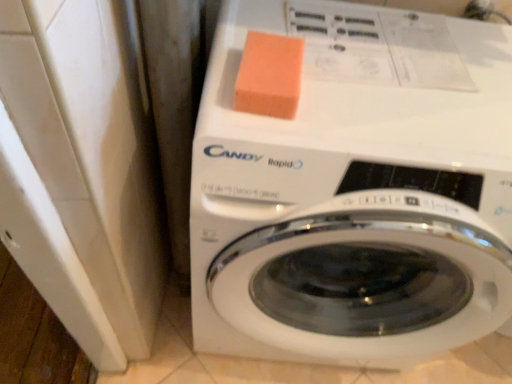
Question: Is orange sponge at upper center with white glossy washing machine at center?

Choices:
 (A) yes
 (B) no

Answer: (B)

Question: Is orange sponge at upper center further to camera compared to white glossy washing machine at center?

Choices:
 (A) yes
 (B) no

Answer: (A)

Question: From the image's perspective, is orange sponge at upper center under white glossy washing machine at center?

Choices:
 (A) yes
 (B) no

Answer: (B)

Question: Would you say orange sponge at upper center is a long distance from white glossy washing machine at center?

Choices:
 (A) yes
 (B) no

Answer: (B)

Question: Is orange sponge at upper center facing towards white glossy washing machine at center?

Choices:
 (A) yes
 (B) no

Answer: (B)

Question: Can white glossy washing machine at center be found inside orange sponge at upper center?

Choices:
 (A) no
 (B) yes

Answer: (A)

Question: Is white glossy washing machine at center next to orange sponge at upper center?

Choices:
 (A) no
 (B) yes

Answer: (A)

Question: From the image's perspective, would you say white glossy washing machine at center is shown under orange sponge at upper center?

Choices:
 (A) no
 (B) yes

Answer: (B)

Question: Can you confirm if white glossy washing machine at center is taller than orange sponge at upper center?

Choices:
 (A) yes
 (B) no

Answer: (A)

Question: Is white glossy washing machine at center positioned with its back to orange sponge at upper center?

Choices:
 (A) yes
 (B) no

Answer: (B)

Question: Considering the relative sizes of white glossy washing machine at center and orange sponge at upper center in the image provided, is white glossy washing machine at center thinner than orange sponge at upper center?

Choices:
 (A) no
 (B) yes

Answer: (A)

Question: Could you tell me if white glossy washing machine at center is turned towards orange sponge at upper center?

Choices:
 (A) yes
 (B) no

Answer: (B)

Question: Looking at their shapes, would you say white glossy washing machine at center is wider or thinner than orange sponge at upper center?

Choices:
 (A) wide
 (B) thin

Answer: (A)